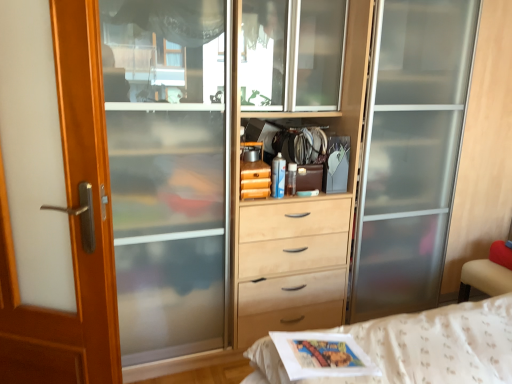
The image size is (512, 384). What are the coordinates of `wooden door at left` in the screenshot? It's located at (70, 229).

Describe the element at coordinates (70, 229) in the screenshot. I see `wooden door at left` at that location.

In order to click on matte gray magazine at center in this screenshot , I will do `click(336, 164)`.

What do you see at coordinates (336, 164) in the screenshot? This screenshot has height=384, width=512. I see `matte gray magazine at center` at bounding box center [336, 164].

Identify the location of wooden door at left. coord(70,229).

Based on their positions, is wooden door at left located to the left or right of matte gray magazine at center?

Clearly, wooden door at left is on the left of matte gray magazine at center in the image.

From the picture: Relative to matte gray magazine at center, is wooden door at left in front or behind?

In the image, wooden door at left appears in front of matte gray magazine at center.

Which point is more forward, (51, 20) or (348, 167)?

Point (51, 20)

From the image's perspective, is wooden door at left positioned above or below matte gray magazine at center?

wooden door at left is below matte gray magazine at center.

From a real-world perspective, relative to matte gray magazine at center, is wooden door at left vertically above or below?

wooden door at left is below matte gray magazine at center.

Which of these two, wooden door at left or matte gray magazine at center, is thinner?

wooden door at left.

Is wooden door at left taller than matte gray magazine at center?

Indeed, wooden door at left has a greater height compared to matte gray magazine at center.

Considering the relative sizes of wooden door at left and matte gray magazine at center in the image provided, is wooden door at left bigger than matte gray magazine at center?

Yes.

Is matte gray magazine at center a part of wooden door at left?

No, matte gray magazine at center is not a part of wooden door at left.

Can you see wooden door at left touching matte gray magazine at center?

They are not placed beside each other.

Is wooden door at left aimed at matte gray magazine at center?

No, wooden door at left does not turn towards matte gray magazine at center.

How many degrees apart are the facing directions of wooden door at left and matte gray magazine at center?

The facing directions of wooden door at left and matte gray magazine at center are 30.7 degrees apart.

Measure the distance between wooden door at left and matte gray magazine at center.

They are 1.32 meters apart.

The width and height of the screenshot is (512, 384). Identify the location of screen door that is on the left side of matte gray magazine at center. (70, 229).

Would you say matte gray magazine at center is to the left or to the right of wooden door at left in the picture?

Based on their positions, matte gray magazine at center is located to the right of wooden door at left.

Which object is more forward, matte gray magazine at center or wooden door at left?

wooden door at left is closer to the camera.

Does point (337, 179) appear closer or farther from the camera than point (103, 92)?

Point (337, 179) appears to be farther away from the viewer than point (103, 92).

From the image's perspective, between matte gray magazine at center and wooden door at left, who is located below?

wooden door at left, from the image's perspective.

From a real-world perspective, is matte gray magazine at center positioned above or below wooden door at left?

In terms of real-world spatial position, matte gray magazine at center is above wooden door at left.

Considering the sizes of objects matte gray magazine at center and wooden door at left in the image provided, who is wider, matte gray magazine at center or wooden door at left?

With larger width is matte gray magazine at center.

Consider the image. From their relative heights in the image, would you say matte gray magazine at center is taller or shorter than wooden door at left?

Considering their sizes, matte gray magazine at center has less height than wooden door at left.

Between matte gray magazine at center and wooden door at left, which one has larger size?

wooden door at left.

Is matte gray magazine at center spatially inside wooden door at left, or outside of it?

matte gray magazine at center is located beyond the bounds of wooden door at left.

Would you say matte gray magazine at center is a long distance from wooden door at left?

Yes, matte gray magazine at center is far from wooden door at left.

Does matte gray magazine at center turn towards wooden door at left?

No, matte gray magazine at center is not aimed at wooden door at left.

How much distance is there between matte gray magazine at center and wooden door at left?

The distance of matte gray magazine at center from wooden door at left is 1.32 meters.

The height and width of the screenshot is (384, 512). Identify the location of screen door that is below the matte gray magazine at center (from the image's perspective). (70, 229).

Identify the location of screen door that appears on the left of matte gray magazine at center. This screenshot has height=384, width=512. (70, 229).

You are a GUI agent. You are given a task and a screenshot of the screen. Output one action in this format:
    pyautogui.click(x=<x>, y=<y>)
    Task: Click on the screen door located below the matte gray magazine at center (from the image's perspective)
    The height and width of the screenshot is (384, 512).
    Given the screenshot: What is the action you would take?
    pyautogui.click(x=70, y=229)